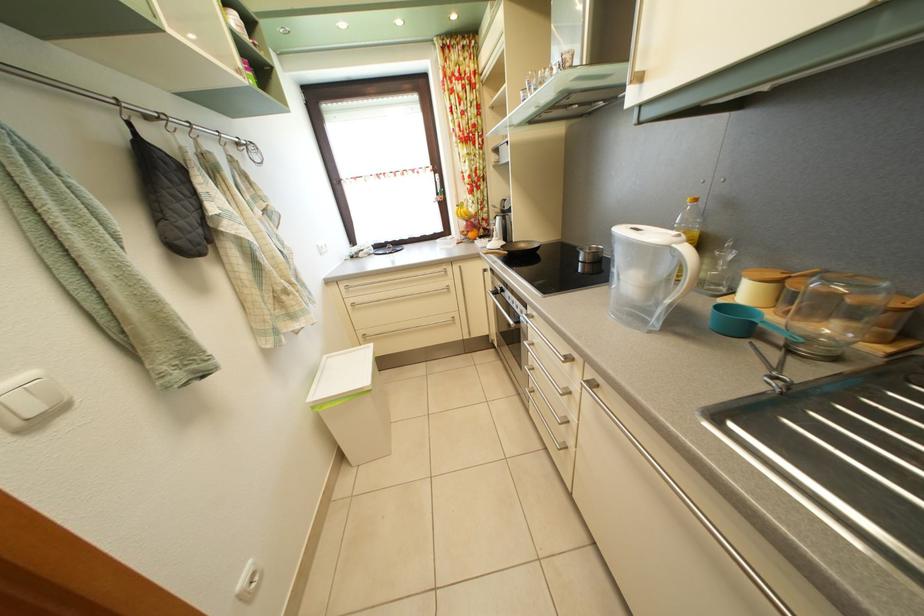
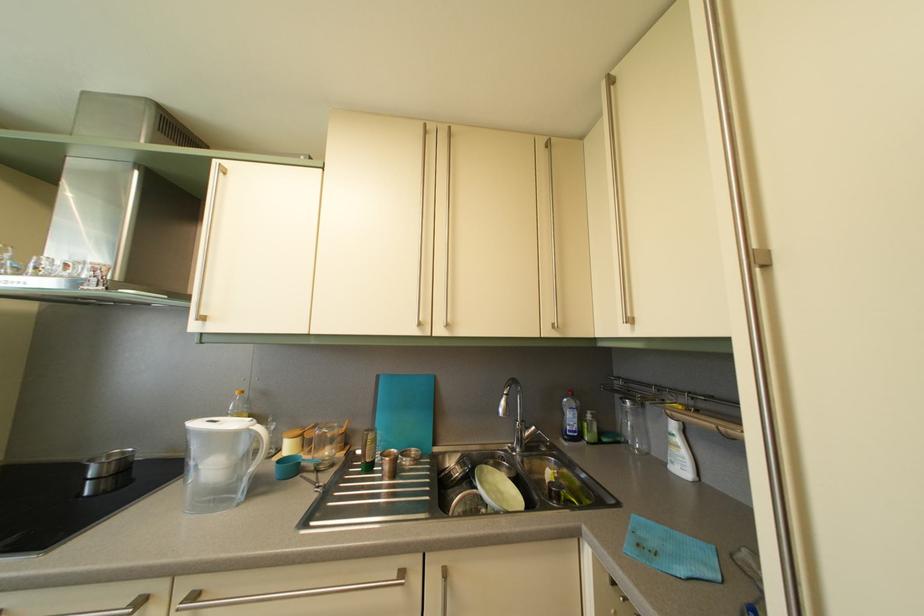
Where in the second image is the point corresponding to pixel 738 265 from the first image?

(282, 435)